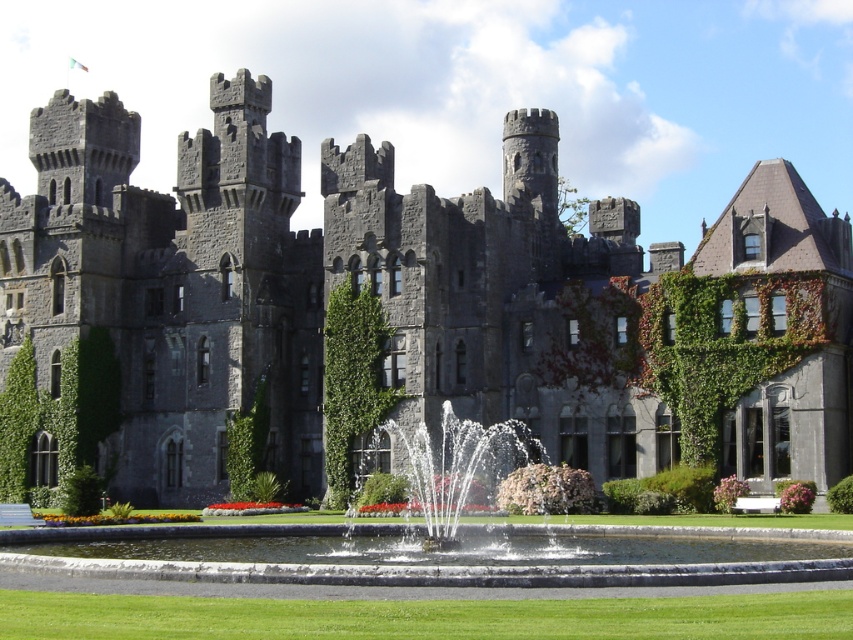
This screenshot has height=640, width=853. What do you see at coordinates (459, 468) in the screenshot? I see `white water at center` at bounding box center [459, 468].

Who is lower down, white water at center or green leafy ivy at center?

white water at center is below.

Who is more distant from viewer, (x=436, y=456) or (x=339, y=500)?

Positioned behind is point (x=436, y=456).

Where is `white water at center`? This screenshot has height=640, width=853. white water at center is located at coordinates (459, 468).

Looking at this image, is green grass at lower center positioned before white water at center?

Yes, green grass at lower center is in front of white water at center.

This screenshot has height=640, width=853. Describe the element at coordinates (426, 616) in the screenshot. I see `green grass at lower center` at that location.

Does point (90, 600) come in front of point (453, 428)?

Yes, point (90, 600) is closer to viewer.

Locate an element on the screen. green grass at lower center is located at coordinates (426, 616).

This screenshot has height=640, width=853. Identify the location of green grass at lower center. (426, 616).

Locate an element on the screen. This screenshot has width=853, height=640. green grass at lower center is located at coordinates (426, 616).